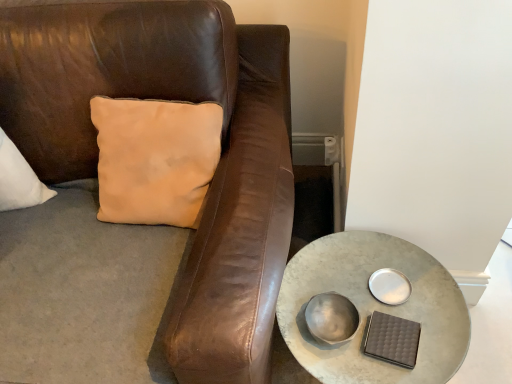
Question: From a real-world perspective, is metallic silver bowl at lower center positioned under metallic gray table at lower right based on gravity?

Choices:
 (A) yes
 (B) no

Answer: (B)

Question: Are metallic silver bowl at lower center and metallic gray table at lower right located far from each other?

Choices:
 (A) yes
 (B) no

Answer: (B)

Question: Considering the relative sizes of metallic silver bowl at lower center and metallic gray table at lower right in the image provided, is metallic silver bowl at lower center taller than metallic gray table at lower right?

Choices:
 (A) yes
 (B) no

Answer: (B)

Question: Does metallic silver bowl at lower center have a lesser width compared to metallic gray table at lower right?

Choices:
 (A) no
 (B) yes

Answer: (B)

Question: Is the surface of metallic silver bowl at lower center in direct contact with metallic gray table at lower right?

Choices:
 (A) yes
 (B) no

Answer: (B)

Question: Is metallic gray table at lower right a part of metallic silver bowl at lower center?

Choices:
 (A) no
 (B) yes

Answer: (A)

Question: Does metallic gray table at lower right have a lesser width compared to metallic silver bowl at lower center?

Choices:
 (A) yes
 (B) no

Answer: (B)

Question: Is metallic gray table at lower right shorter than metallic silver bowl at lower center?

Choices:
 (A) yes
 (B) no

Answer: (B)

Question: From the image's perspective, is metallic gray table at lower right below metallic silver bowl at lower center?

Choices:
 (A) yes
 (B) no

Answer: (A)

Question: Considering the relative sizes of metallic gray table at lower right and metallic silver bowl at lower center in the image provided, is metallic gray table at lower right wider than metallic silver bowl at lower center?

Choices:
 (A) yes
 (B) no

Answer: (A)

Question: Is metallic gray table at lower right turned away from metallic silver bowl at lower center?

Choices:
 (A) yes
 (B) no

Answer: (B)

Question: Is metallic gray table at lower right taller than metallic silver bowl at lower center?

Choices:
 (A) yes
 (B) no

Answer: (A)

Question: From a real-world perspective, is metallic silver bowl at lower center positioned above or below metallic gray table at lower right?

Choices:
 (A) above
 (B) below

Answer: (A)